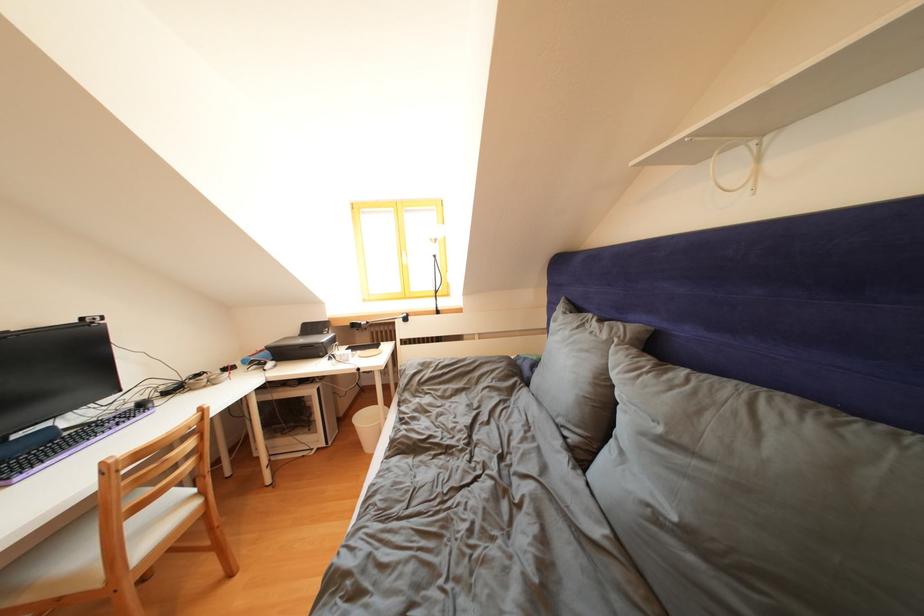
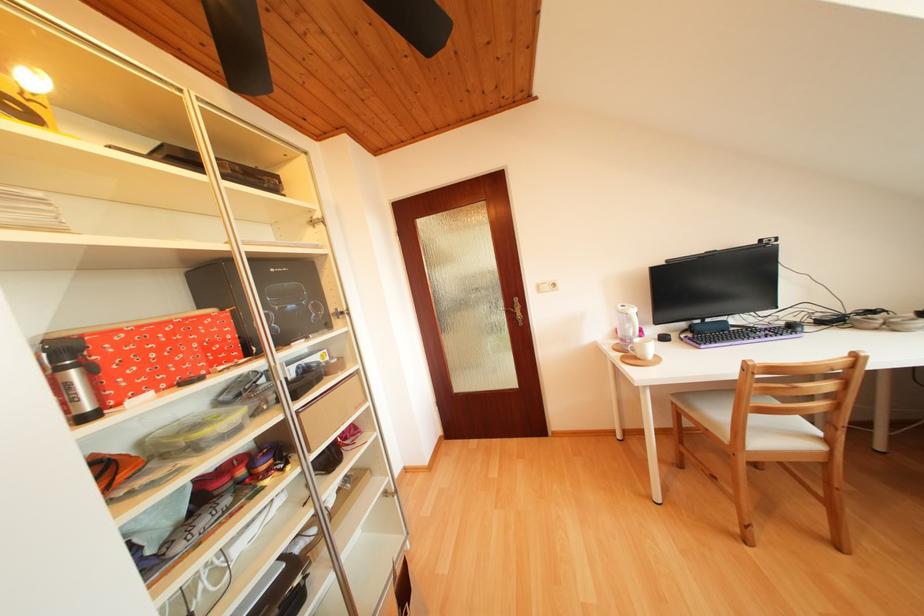
Where in the second image is the point corresponding to (90,323) from the first image?

(769, 246)